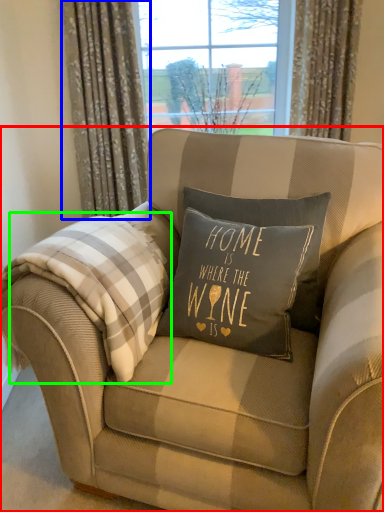
Question: Considering the real-world distances, which object is farthest from chair (highlighted by a red box)? curtain (highlighted by a blue box) or flannel (highlighted by a green box)?

Choices:
 (A) curtain
 (B) flannel

Answer: (A)